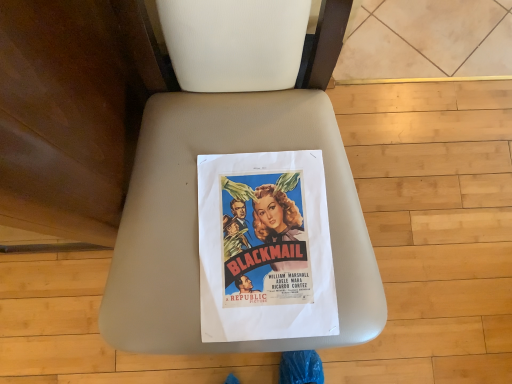
The height and width of the screenshot is (384, 512). What are the coordinates of `beige leather chair at center` in the screenshot? It's located at (197, 220).

Describe the element at coordinates (197, 220) in the screenshot. I see `beige leather chair at center` at that location.

Identify the location of beige leather chair at center. Image resolution: width=512 pixels, height=384 pixels. (197, 220).